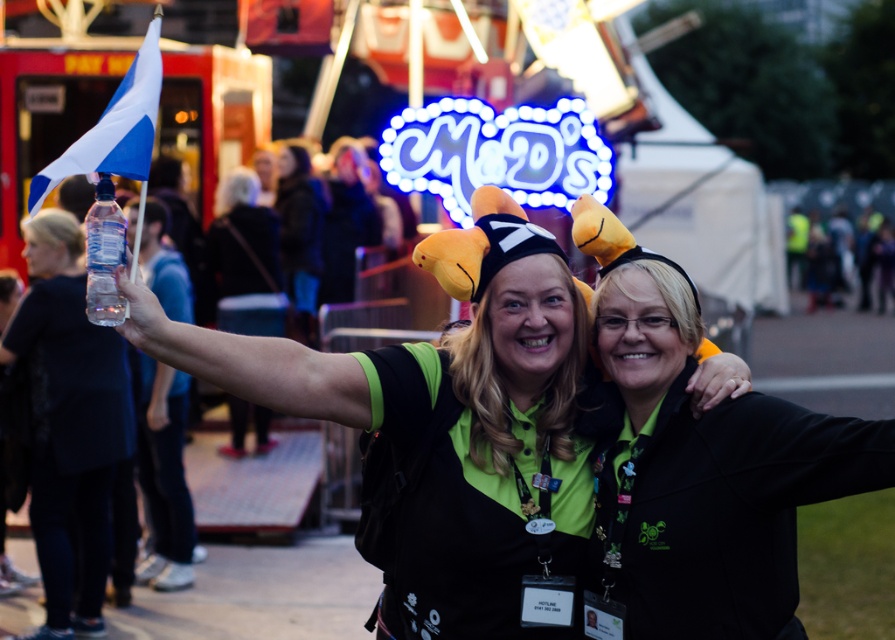
You are taking a photo of the two people in the scene. The first person is at point (567, 397) and the second is at point (67, 253). Which person will appear larger in your photo?

The person at point (567, 397) will appear larger in the photo because they are closer to the camera than the person at point (67, 253).

You are standing at a festival and want to take a photo of the point at coordinates point (499, 556). The camera you are using has a maximum focus range of 70 feet. Will the camera be able to focus on the point?

The distance of point (499, 556) from viewer is 71.20 feet, which exceeds the camera maximum focus range of 70 feet. The camera will not be able to focus on the point.

You are at the festival and want to locate the clear plastic bottle at upper left. Which direction should you look relative to the black matte hat at center?

The clear plastic bottle at upper left is to the left of the black matte hat at center.